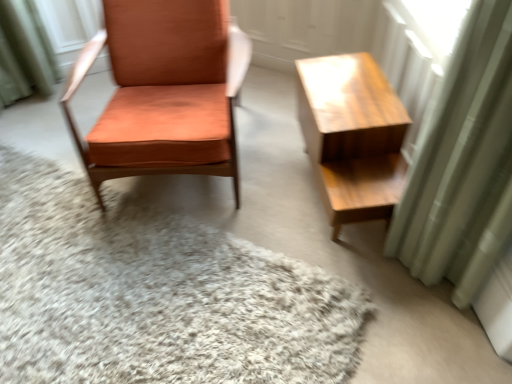
Question: In the image, is light brown wood table at right positioned in front of or behind green fabric curtain at right?

Choices:
 (A) behind
 (B) front

Answer: (A)

Question: From the image's perspective, relative to green fabric curtain at right, is light brown wood table at right above or below?

Choices:
 (A) above
 (B) below

Answer: (B)

Question: Estimate the real-world distances between objects in this image. Which object is closer to the green fabric curtain at right?

Choices:
 (A) white shaggy rug at center
 (B) orange leather chair at left
 (C) light brown wood table at right

Answer: (C)

Question: Which of these objects is positioned closest to the white shaggy rug at center?

Choices:
 (A) light brown wood table at right
 (B) green fabric curtain at right
 (C) orange leather chair at left

Answer: (C)